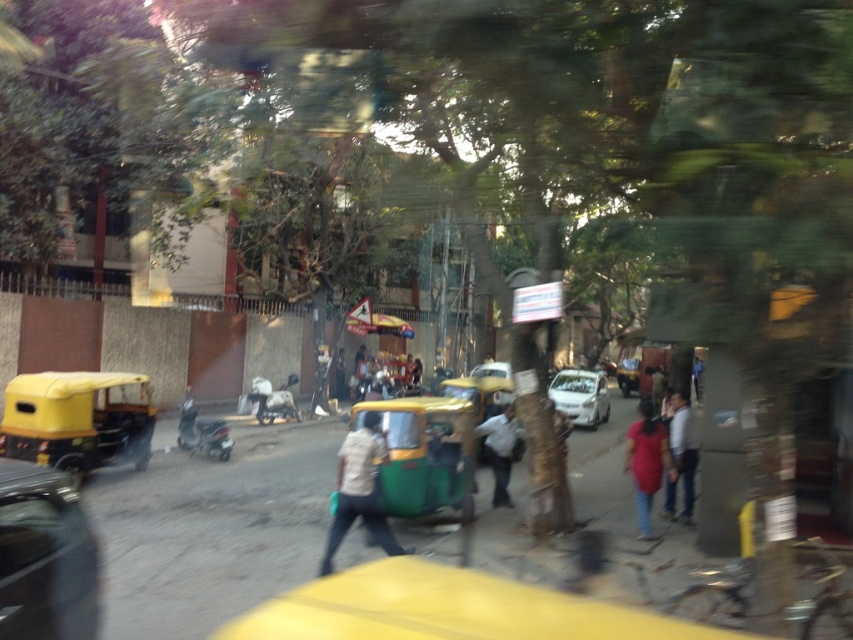
Question: Is yellow matte auto-rickshaw at left closer to the viewer compared to matte red shirt at center?

Choices:
 (A) no
 (B) yes

Answer: (A)

Question: Which object is positioned closest to the white glossy car at center?

Choices:
 (A) yellow rubber taxi at lower center
 (B) matte red shirt at center

Answer: (B)

Question: Can you confirm if yellow rubber taxi at lower center is positioned above yellow matte auto-rickshaw at left?

Choices:
 (A) no
 (B) yes

Answer: (B)

Question: Is yellow rubber taxi at lower center wider than white glossy car at center?

Choices:
 (A) no
 (B) yes

Answer: (A)

Question: Which point is farther from the camera taking this photo?

Choices:
 (A) (497, 492)
 (B) (392, 467)

Answer: (A)

Question: Among these points, which one is farthest from the camera?

Choices:
 (A) (635, 365)
 (B) (3, 548)
 (C) (479, 451)

Answer: (A)